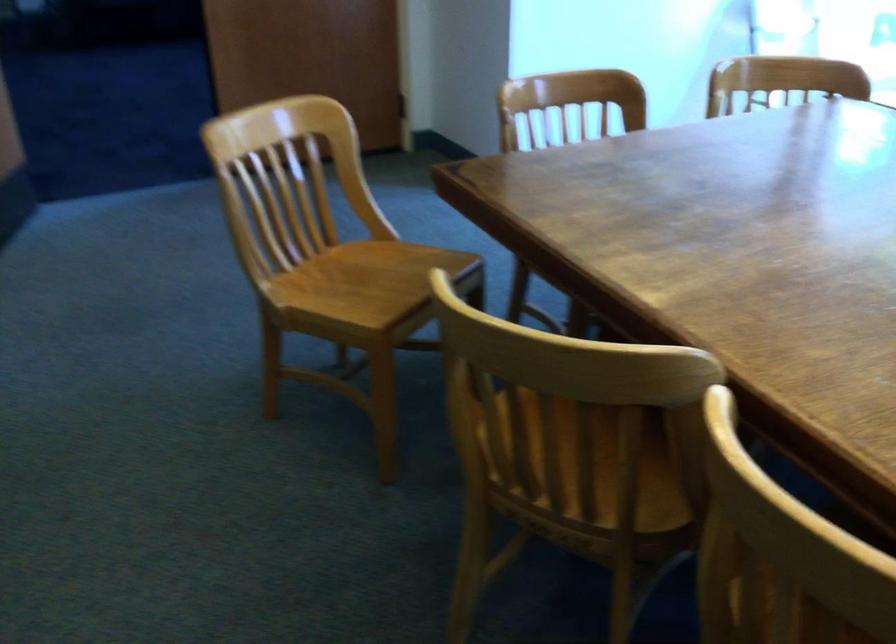
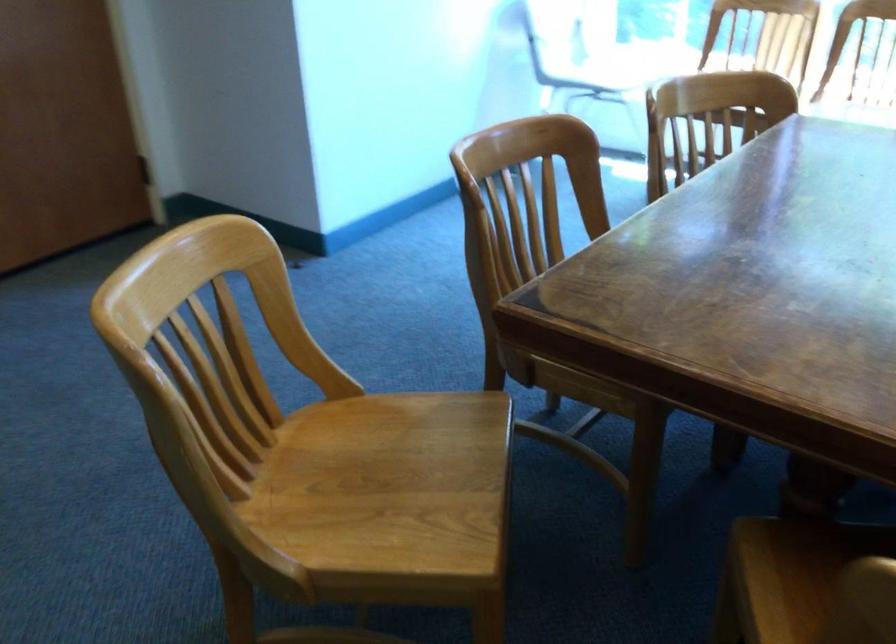
Question: The camera is either moving clockwise (left) or counter-clockwise (right) around the object. The first image is from the beginning of the video and the second image is from the end. Is the camera moving left or right when shooting the video?

Choices:
 (A) Left
 (B) Right

Answer: (A)